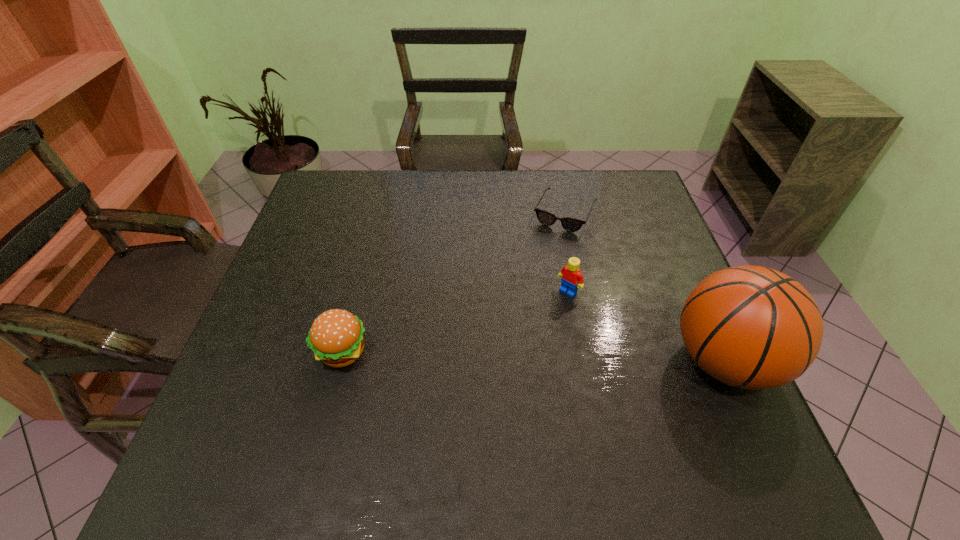
Where is `vacant space located 0.170m on the front lenses of the sunglasses`? The image size is (960, 540). vacant space located 0.170m on the front lenses of the sunglasses is located at coordinates (537, 272).

At what (x,y) coordinates should I click in order to perform the action: click on vacant space situated 0.330m on the face of the Lego. Please return your answer as a coordinate pair (x, y). This screenshot has height=540, width=960. Looking at the image, I should click on (475, 388).

Identify the location of vacant region located 0.270m on the face of the Lego. This screenshot has width=960, height=540. (493, 369).

In order to click on blank space located 0.380m on the face of the Lego in this screenshot , I will do tap(460, 404).

At what (x,y) coordinates should I click in order to perform the action: click on object present at the far edge. Please return your answer as a coordinate pair (x, y). Looking at the image, I should click on (570, 224).

The height and width of the screenshot is (540, 960). I want to click on object positioned at the near edge, so click(x=751, y=327).

The width and height of the screenshot is (960, 540). I want to click on object at the left edge, so click(336, 337).

Where is `object at the right edge`? object at the right edge is located at coordinates (751, 327).

Image resolution: width=960 pixels, height=540 pixels. I want to click on object present at the near right corner, so click(751, 327).

What are the coordinates of `free region at the far edge` in the screenshot? It's located at [409, 180].